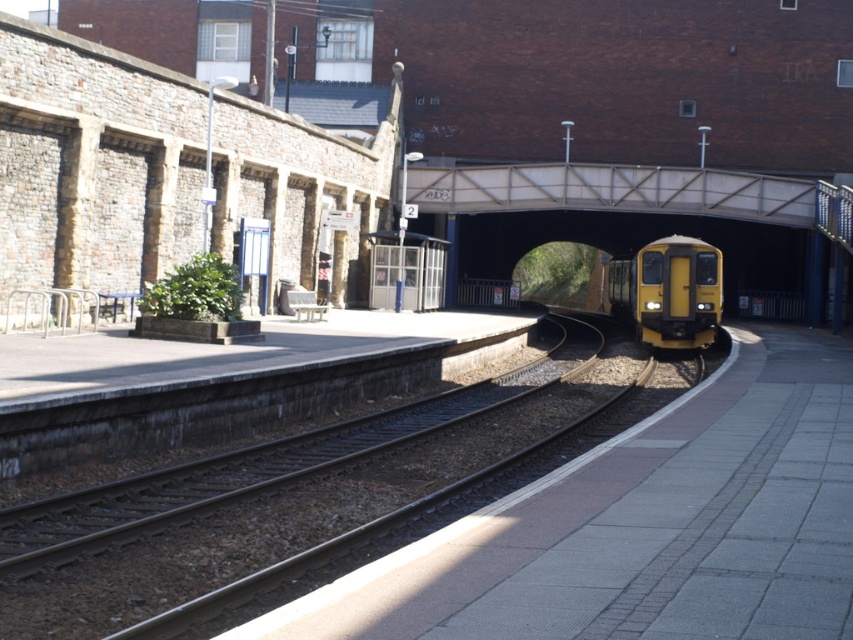
Question: Among these objects, which one is farthest from the camera?

Choices:
 (A) metallic gray bridge at upper center
 (B) smooth metal track at center
 (C) yellow matte train at center

Answer: (C)

Question: Among these objects, which one is farthest from the camera?

Choices:
 (A) metallic gray bridge at upper center
 (B) smooth metal track at center

Answer: (A)

Question: Is smooth metal track at center positioned at the back of metallic gray bridge at upper center?

Choices:
 (A) yes
 (B) no

Answer: (B)

Question: Which point appears farthest from the camera in this image?

Choices:
 (A) (137, 563)
 (B) (578, 189)

Answer: (B)

Question: Is smooth metal track at center in front of yellow matte train at center?

Choices:
 (A) yes
 (B) no

Answer: (A)

Question: Does smooth metal track at center appear over metallic gray bridge at upper center?

Choices:
 (A) no
 (B) yes

Answer: (A)